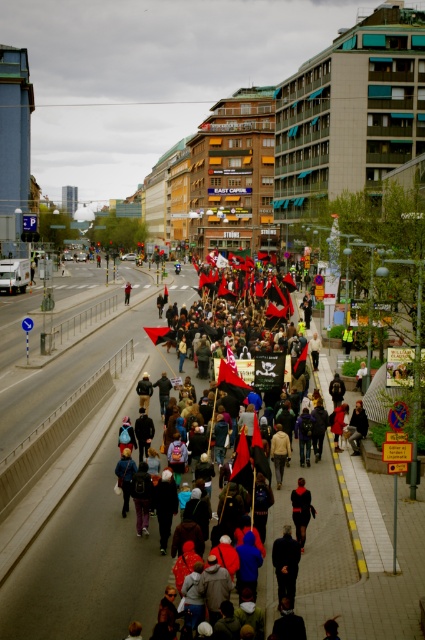
Does dark red fabric flag at center appear on the right side of dark blue jacket at center?

Indeed, dark red fabric flag at center is positioned on the right side of dark blue jacket at center.

Is dark red fabric flag at center positioned behind dark blue jacket at center?

No, dark red fabric flag at center is closer to the viewer.

Between point (238, 378) and point (125, 296), which one is positioned behind?

The point (125, 296) is more distant.

This screenshot has width=425, height=640. Identify the location of dark red fabric flag at center. (354, 532).